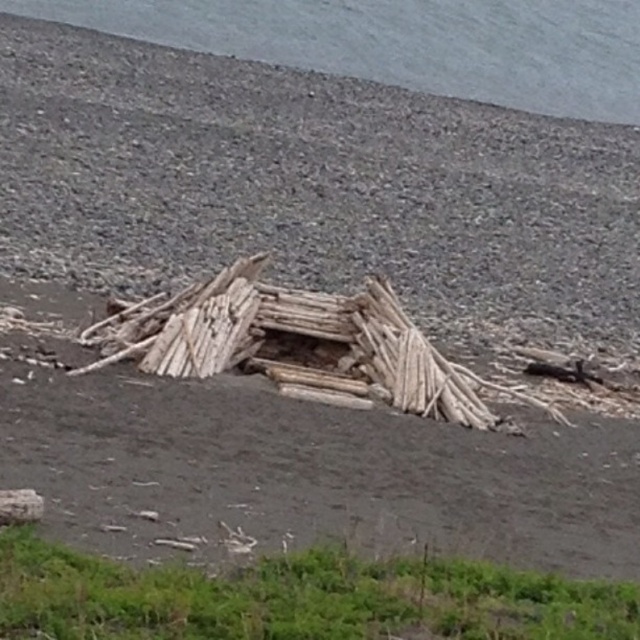
You are standing in front of the makeshift driftwood structure on the beach. You notice the gray water at upper center and the natural wood driftwood at center. Which object is closer to you?

The natural wood driftwood at center is closer to you than the gray water at upper center because the gray water at upper center is further to the viewer.

You are a photographer trying to capture the entire scene of the gray water at upper center and the natural wood driftwood at center. Which object would you need to frame more prominently in your shot to ensure both are visible?

The gray water at upper center is larger in size than the natural wood driftwood at center, so you should frame the gray water at upper center more prominently to accommodate its larger size while still including the natural wood driftwood at center in the shot.